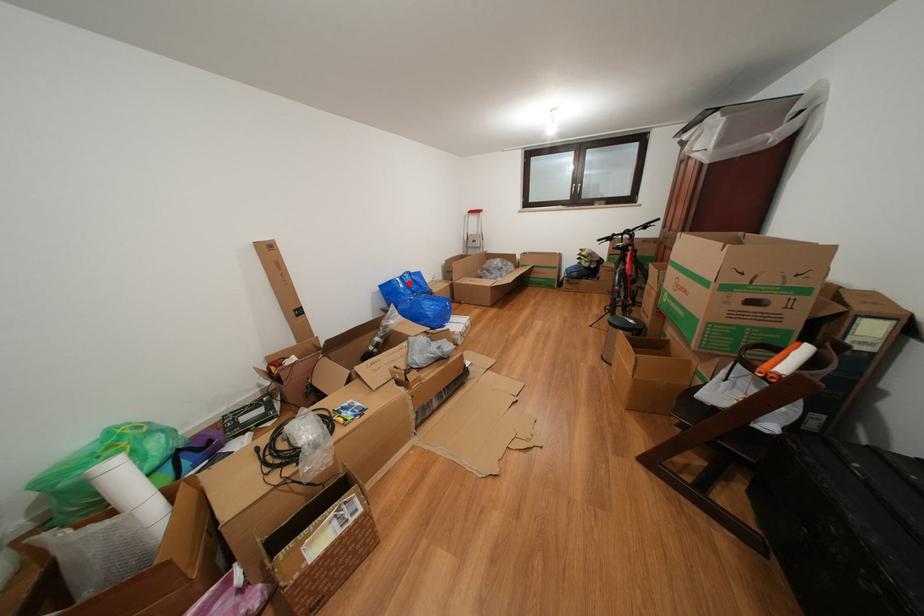
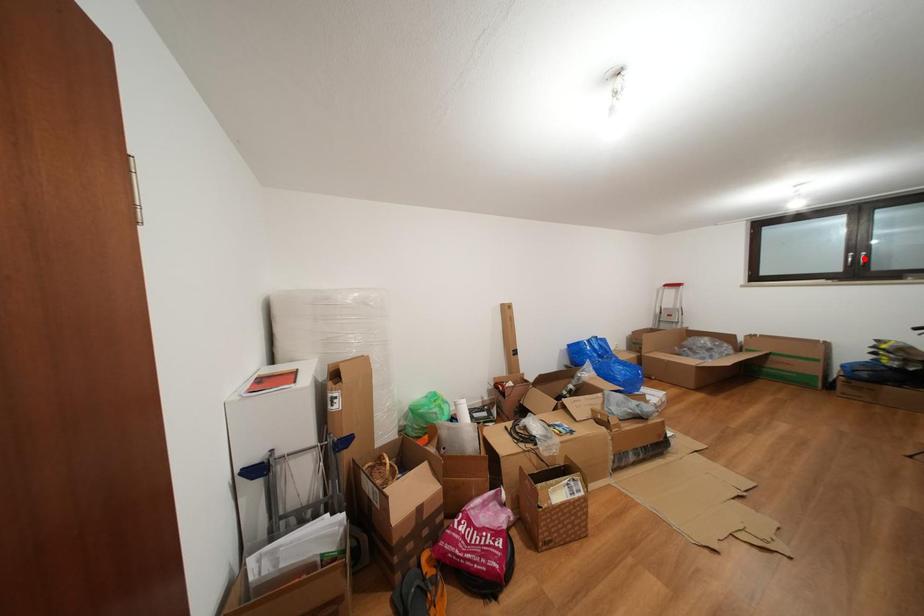
I am providing you with two images of the same scene from different viewpoints. A red point is marked on the first image and another point is marked on the second image. Do the highlighted points in image1 and image2 indicate the same real-world spot?

No